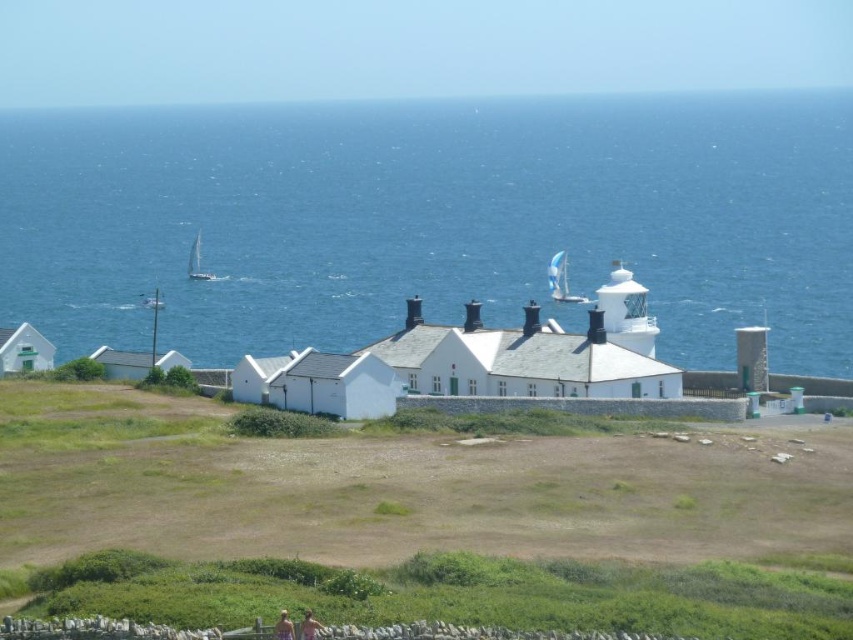
You are standing at the base of the white lighthouse and want to reach the blue water at center. In which direction should you walk to get there?

The blue water at center is located at point 0.345 on the x and 0.508 on the y coordinate. Since you are at the base of the lighthouse, you should walk towards the coordinates provided to reach the blue water at center.

You are standing at the lighthouse and want to get to the blue water at center. Which direction should you walk to reach it?

You should walk towards the center direction to reach the blue water at center.